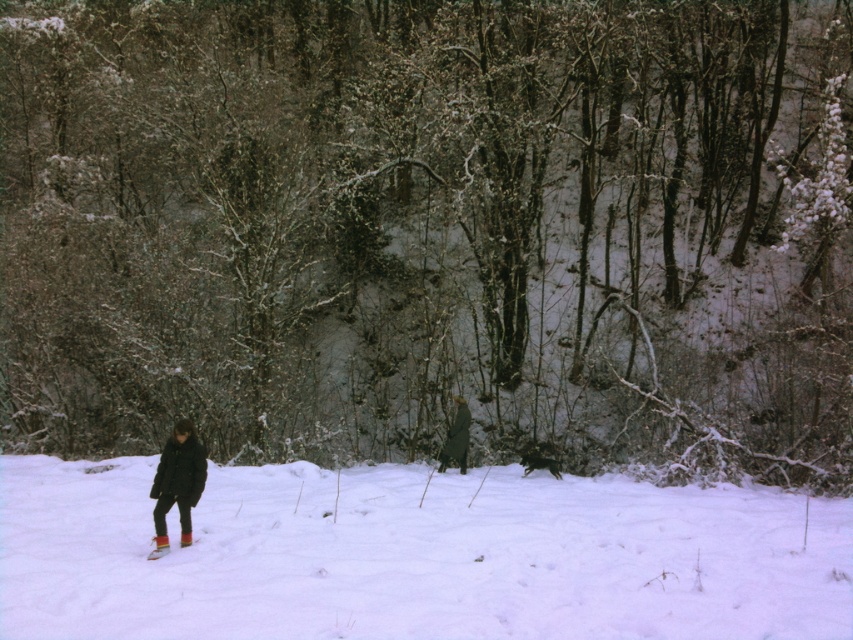
Question: Is green wool coat at center bigger than multicolored fabric ski at lower left?

Choices:
 (A) yes
 (B) no

Answer: (A)

Question: Does white fluffy snow at center come in front of matte black jacket at center?

Choices:
 (A) no
 (B) yes

Answer: (B)

Question: Based on their relative distances, which object is nearer to the matte black jacket at center?

Choices:
 (A) multicolored fabric ski at lower left
 (B) green wool coat at center

Answer: (A)

Question: Which point appears closest to the camera in this image?

Choices:
 (A) pyautogui.click(x=189, y=516)
 (B) pyautogui.click(x=611, y=634)

Answer: (B)

Question: Which point is farther to the camera?

Choices:
 (A) matte black jacket at center
 (B) multicolored fabric ski at lower left
 (C) green wool coat at center

Answer: (C)

Question: Is the position of matte black jacket at center more distant than that of multicolored fabric ski at lower left?

Choices:
 (A) yes
 (B) no

Answer: (A)